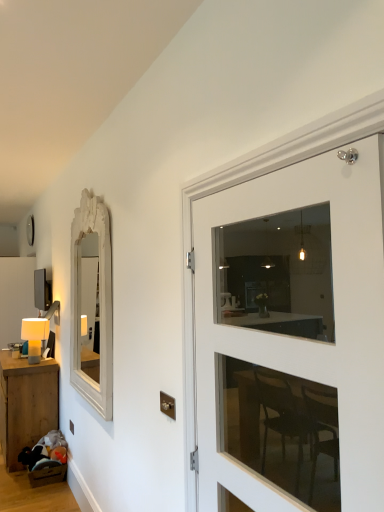
Question: Could you tell me if wooden table at lower left is facing white glass door at right?

Choices:
 (A) yes
 (B) no

Answer: (B)

Question: Considering the relative sizes of wooden table at lower left and white glass door at right in the image provided, is wooden table at lower left bigger than white glass door at right?

Choices:
 (A) yes
 (B) no

Answer: (A)

Question: Does wooden table at lower left have a greater height compared to white glass door at right?

Choices:
 (A) yes
 (B) no

Answer: (B)

Question: From a real-world perspective, is wooden table at lower left located higher than white glass door at right?

Choices:
 (A) no
 (B) yes

Answer: (A)

Question: Does wooden table at lower left have a lesser height compared to white glass door at right?

Choices:
 (A) no
 (B) yes

Answer: (B)

Question: Could white glass door at right be considered to be inside wooden table at lower left?

Choices:
 (A) yes
 (B) no

Answer: (B)

Question: Can you confirm if white glass door at right is shorter than wooden table at lower left?

Choices:
 (A) no
 (B) yes

Answer: (A)

Question: Is white glass door at right located outside wooden table at lower left?

Choices:
 (A) no
 (B) yes

Answer: (B)

Question: Are white glass door at right and wooden table at lower left far apart?

Choices:
 (A) no
 (B) yes

Answer: (B)

Question: Does white glass door at right appear on the right side of wooden table at lower left?

Choices:
 (A) no
 (B) yes

Answer: (B)

Question: Considering the relative positions of white glass door at right and wooden table at lower left in the image provided, is white glass door at right behind wooden table at lower left?

Choices:
 (A) yes
 (B) no

Answer: (B)

Question: Considering the relative sizes of white glass door at right and wooden table at lower left in the image provided, is white glass door at right bigger than wooden table at lower left?

Choices:
 (A) yes
 (B) no

Answer: (B)

Question: Is white carved wood mirror at left outside matte white table lamp at left?

Choices:
 (A) yes
 (B) no

Answer: (A)